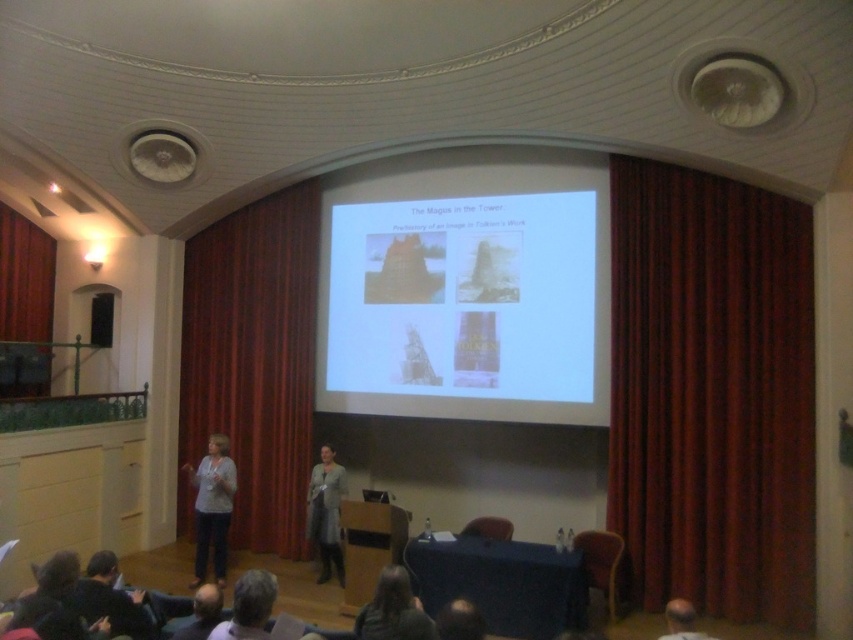
Consider the image. You are an attendee at this presentation. You notice two objects in the scene described. One is the white paper at center and the other is the smooth bald head at lower left. Which object is larger in size?

The white paper at center is bigger than the smooth bald head at lower left.

You are an attendee at the presentation and need to take notes. The presenter is holding a white paper at center and there is a smooth bald head at lower left. Which object is closer to your left side?

The smooth bald head at lower left is closer to your left side because the white paper at center is positioned on the right side of it.

You are an event coordinator setting up for a presentation. You need to adjust the lighting so that the red velvet curtain at center and the velvet dark red curtain at left are both visible. Which curtain should you focus your lights on first to ensure both are properly illuminated?

The red velvet curtain at center is positioned under the velvet dark red curtain at left, so you should focus the lights on the velvet dark red curtain at left first. This way, the light will naturally cascade down to the lower curtain, ensuring both are illuminated without creating shadows.